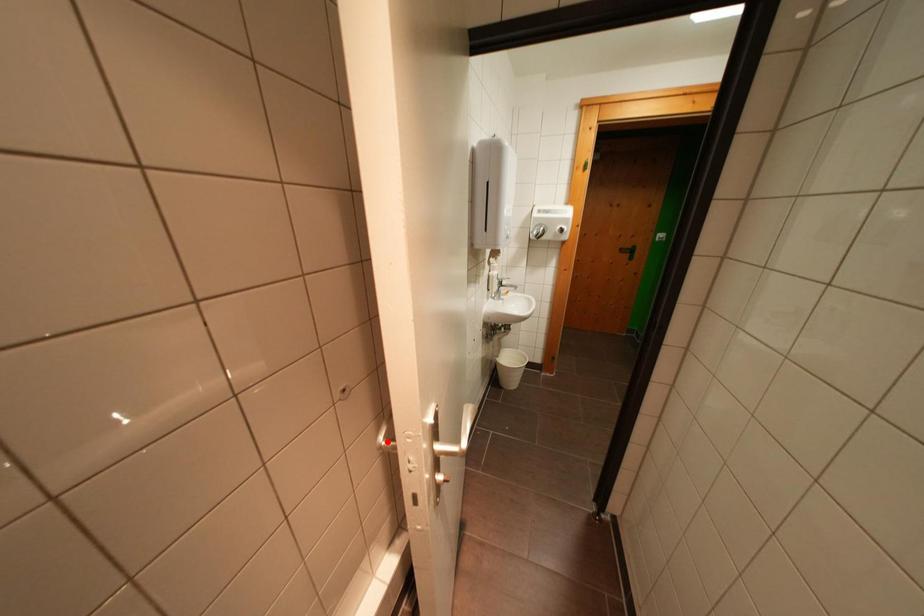
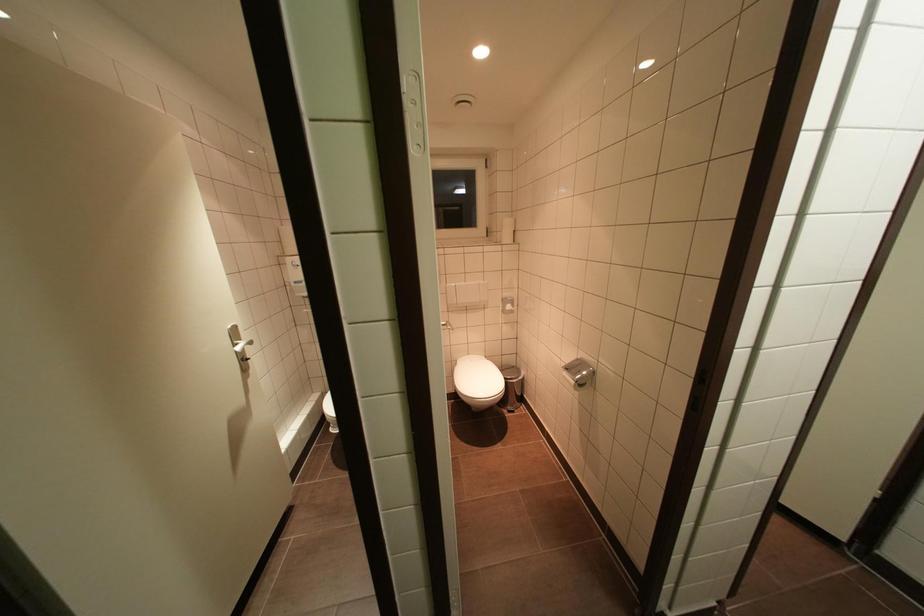
Question: I am providing you with two images of the same scene from different viewpoints. A red point is marked on the first image. Is the red point's position out of view in image 2?

Choices:
 (A) Yes
 (B) No

Answer: (A)